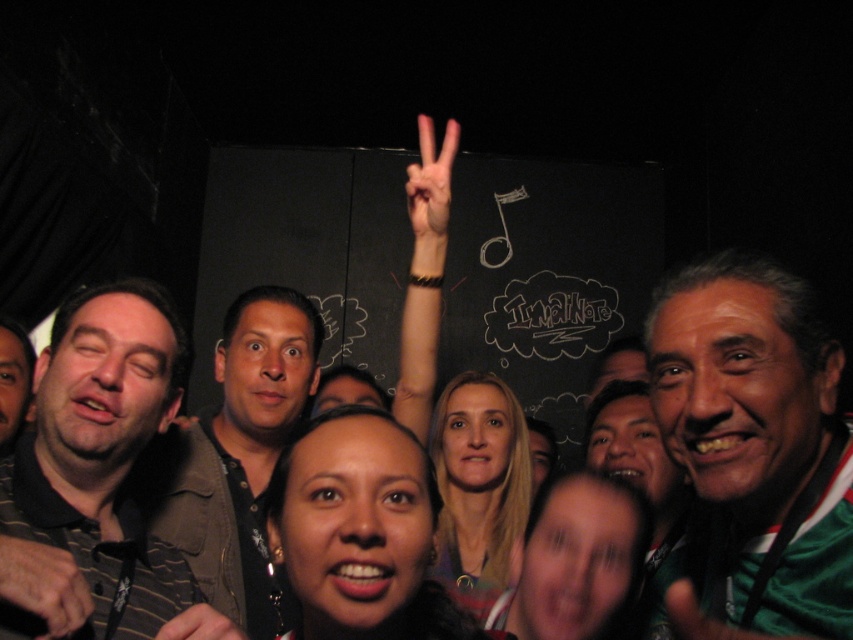
You are a photographer at the event and want to capture a clear photo of the smooth skin hand at center without the brown leather jacket at center blocking it. How should you adjust your camera position?

The brown leather jacket at center is closer to the camera than the smooth skin hand at center. To avoid the jacket blocking the hand, move the camera position closer to the smooth skin hand at center or adjust the angle so the hand becomes more visible beyond the jacket.

You are a photographer trying to capture a group photo of the green jersey at center and the dark brown leather jacket at left. Based on their positions, which object is wider in the image?

The green jersey at center might be wider than dark brown leather jacket at left.